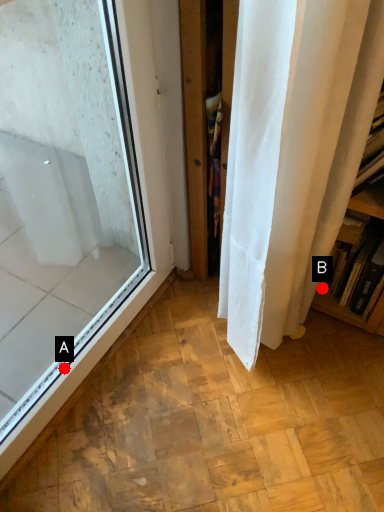
Question: Two points are circled on the image, labeled by A and B beside each circle. Which point appears closest to the camera in this image?

Choices:
 (A) A is closer
 (B) B is closer

Answer: (A)